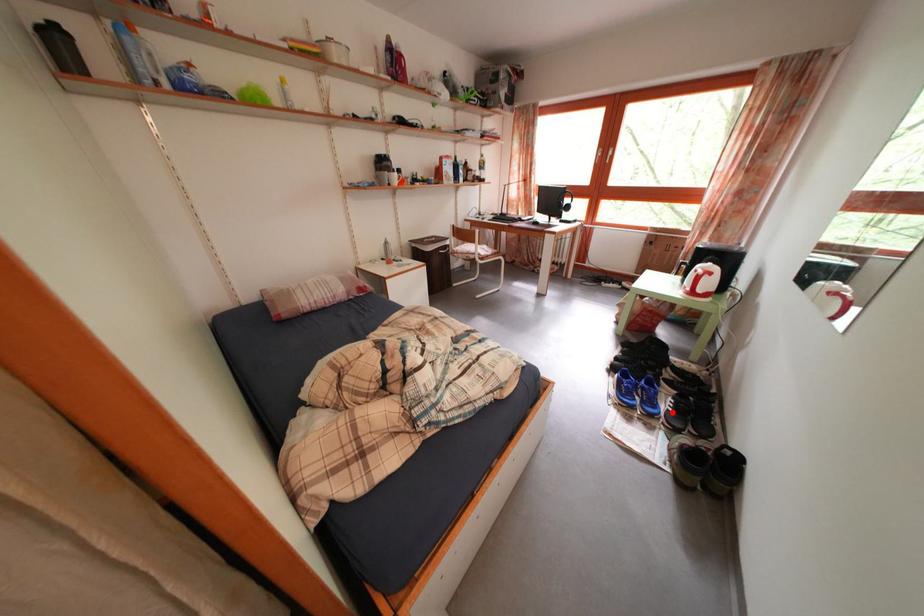
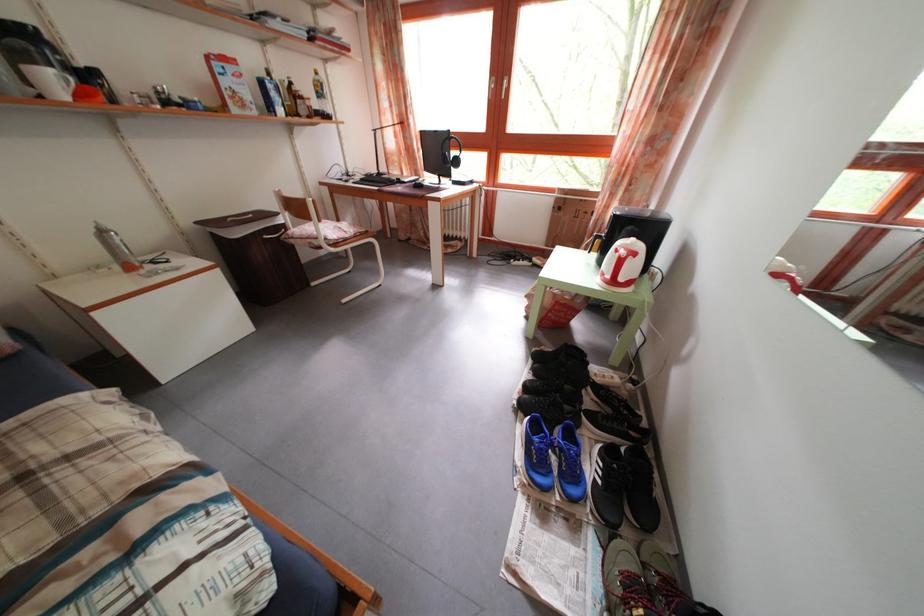
Question: I am providing you with two images of the same scene from different viewpoints. Given a red point in image1, look at the same physical point in image2. Is it:

Choices:
 (A) Closer to the viewpoint
 (B) Farther from the viewpoint

Answer: (B)